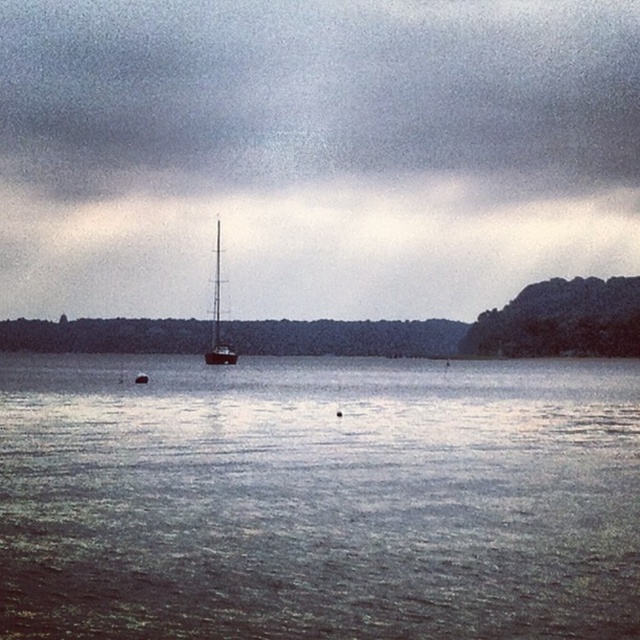
You are standing on the dock and looking at the gray reflective water at center and the metallic silver mast at center. Which object is positioned lower in the image?

The gray reflective water at center is located below the metallic silver mast at center, so it is positioned lower in the image.

Based on the photo, you are standing at the waterfront and want to take a photo of the metallic silver mast at center. However, you notice the gray reflective water at center might be blocking your view. Based on the scene, will the water block the mast in your photo?

The gray reflective water at center is closer to the viewer than the metallic silver mast at center, so the water will block the mast in your photo.